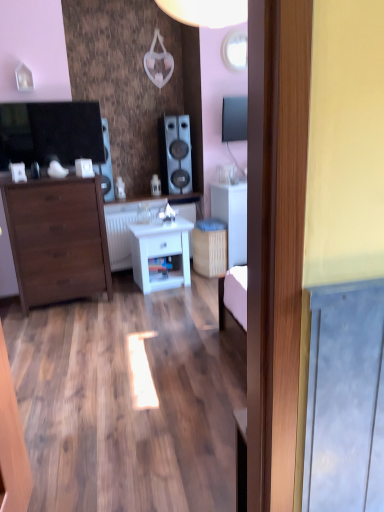
Question: Considering the positions of matte brown chest of drawers at left and white matte cabinet at center in the image, is matte brown chest of drawers at left wider or thinner than white matte cabinet at center?

Choices:
 (A) wide
 (B) thin

Answer: (B)

Question: From a real-world perspective, is matte brown chest of drawers at left physically located above or below white matte cabinet at center?

Choices:
 (A) above
 (B) below

Answer: (A)

Question: Which object is positioned farthest from the matte black speaker at left, positioned as the second speaker in right-to-left order?

Choices:
 (A) white matte cabinet at center
 (B) matte brown chest of drawers at left
 (C) satin black speaker at center, the 2th speaker when ordered from left to right
 (D) white glossy counter top at center, which is the 1th counter top from top to bottom
 (E) white glossy counter top at center, which is counted as the 1th counter top, starting from the bottom

Answer: (A)

Question: Estimate the real-world distances between objects in this image. Which object is farther from the satin black speaker at center, arranged as the 1th speaker when viewed from the right?

Choices:
 (A) white glossy counter top at center, which is counted as the 1th counter top, starting from the bottom
 (B) matte black speaker at left, positioned as the second speaker in right-to-left order
 (C) white glossy counter top at center, which ranks as the second counter top in bottom-to-top order
 (D) white glossy nightstand at center
 (E) white matte cabinet at center

Answer: (D)